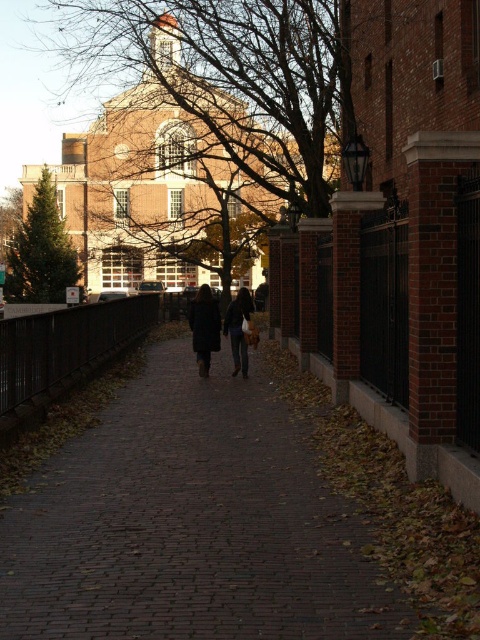
You are standing at point (x=247, y=307) and want to walk to point (x=25, y=244). Given the pathway is flanked by brick walls and a black metal fence, will you have to walk towards or away from the brick walls to reach your destination?

You will have to walk towards the brick walls to reach point (x=25, y=244) because point (x=25, y=244) is behind point (x=247, y=307), meaning it is in the direction of the brick walls.

You are a fashion designer observing two individuals wearing dark brown leather outerwear in the scene. Which of the two items, the dark brown leather coat at center or the dark brown leather jacket at center, is shorter in length?

The dark brown leather coat at center is shorter in length compared to the dark brown leather jacket at center.

You are standing at the center of the cobblestone pathway in the image and want to walk towards the green matte tree at left. Which direction should you face to head directly toward it?

Since the green matte tree at left is located at point 0.394 on the x axis and 0.087 on the y axis, you should face toward the left side of the pathway to head directly toward it.